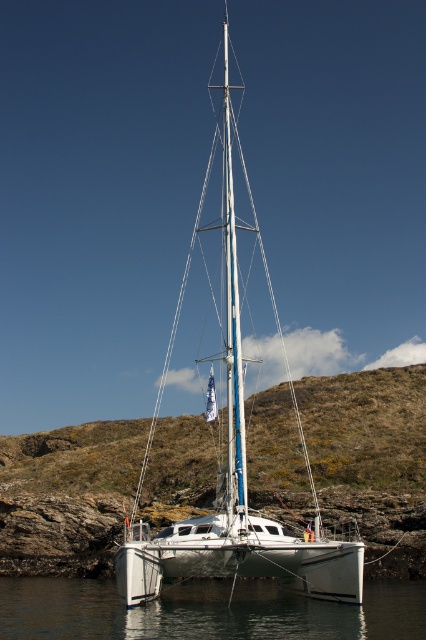
Consider the image. You are a photographer planning to capture the green grassy hillside at center and the white matte sailboat at center in a single wide shot. Based on their sizes in the image, which object should you focus on first to ensure both are in frame?

The green grassy hillside at center is smaller than the white matte sailboat at center, so focusing on the white matte sailboat at center first will help ensure both fit within the frame since it occupies more space.

You are standing on the rocky shoreline near the docked sailboat and looking towards the central area of the image. What do you see at the point marked by the coordinates point [371,458]?

At point [371,458] lies green grassy hillside at center.